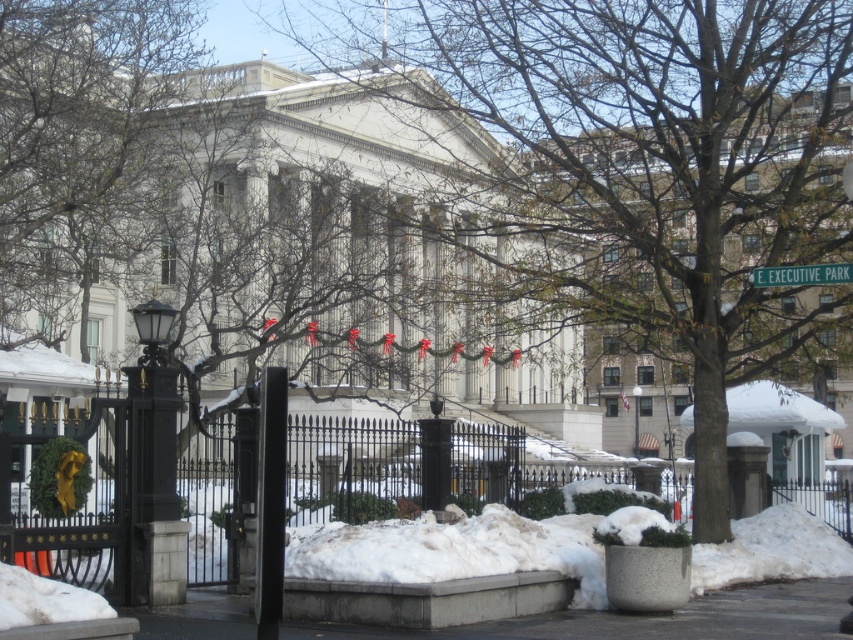
You are standing in front of the grand neoclassical building and want to walk from the black wrought iron gate to the entrance. The gate is at point (13, 48) and the entrance is at point (764, 278). Which point is closer to you as you start walking?

Point (13, 48) is closer to you because it is further to the viewer than point (764, 278), meaning it is physically nearer to your starting position.